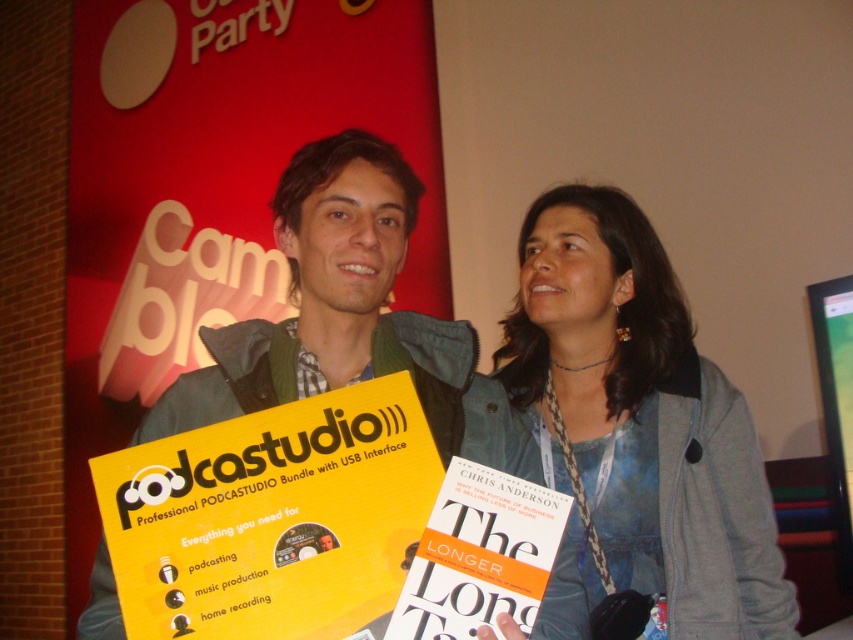
Question: Can you confirm if denim jacket at center is positioned to the left of yellow paperboard at center?

Choices:
 (A) no
 (B) yes

Answer: (A)

Question: Can you confirm if denim jacket at center is positioned to the right of yellow paperboard at center?

Choices:
 (A) no
 (B) yes

Answer: (B)

Question: Among these points, which one is farthest from the camera?

Choices:
 (A) (589, 440)
 (B) (352, 372)

Answer: (A)

Question: Can you confirm if denim jacket at center is positioned to the right of yellow paperboard at center?

Choices:
 (A) no
 (B) yes

Answer: (B)

Question: Among these objects, which one is nearest to the camera?

Choices:
 (A) yellow paperboard at center
 (B) denim jacket at center

Answer: (A)